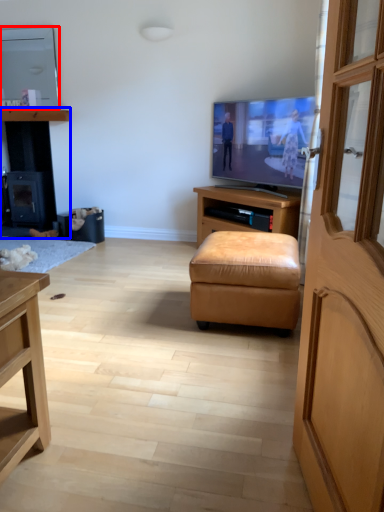
Question: Which object appears farthest to the camera in this image, television (highlighted by a red box) or dresser (highlighted by a blue box)?

Choices:
 (A) television
 (B) dresser

Answer: (B)